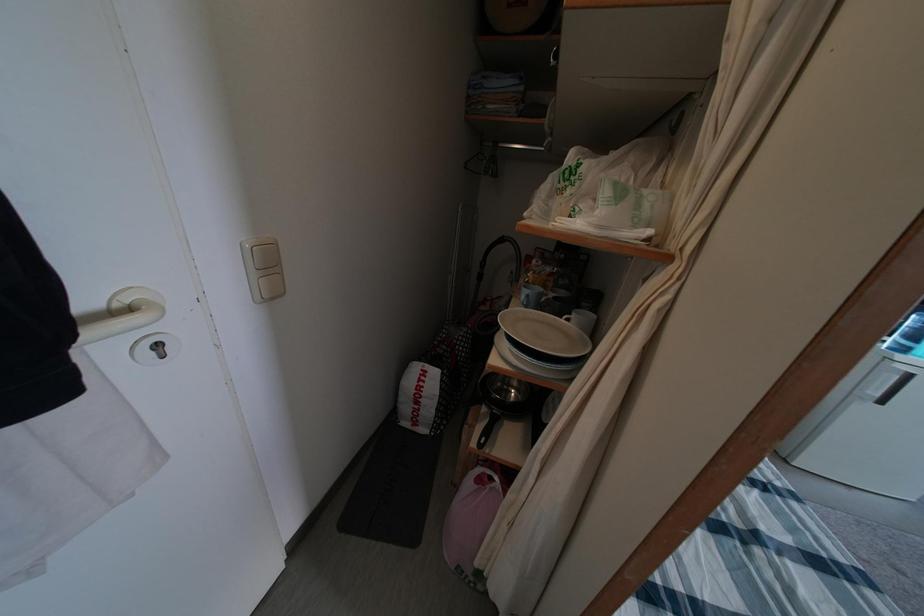
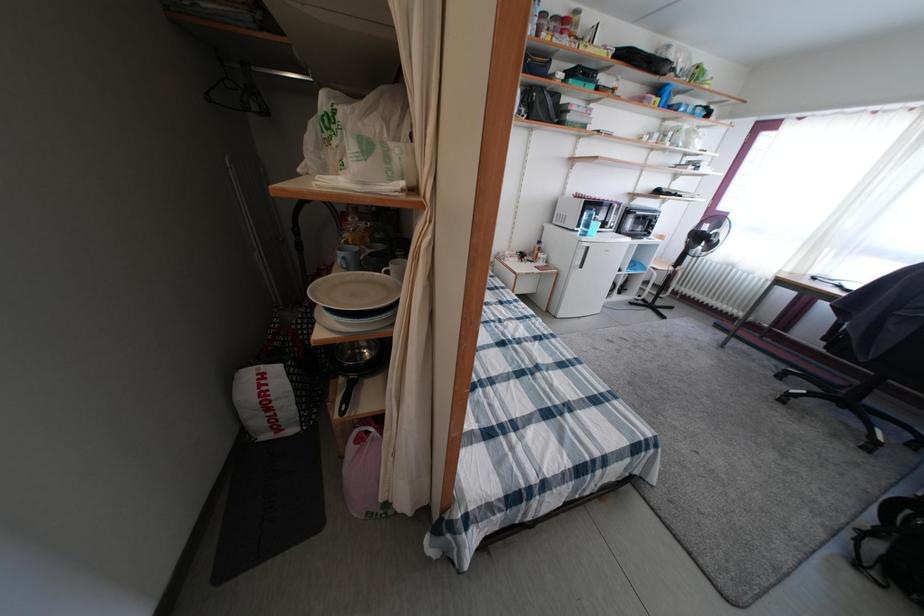
Question: The camera is either moving clockwise (left) or counter-clockwise (right) around the object. The first image is from the beginning of the video and the second image is from the end. Is the camera moving left or right when shooting the video?

Choices:
 (A) Left
 (B) Right

Answer: (A)